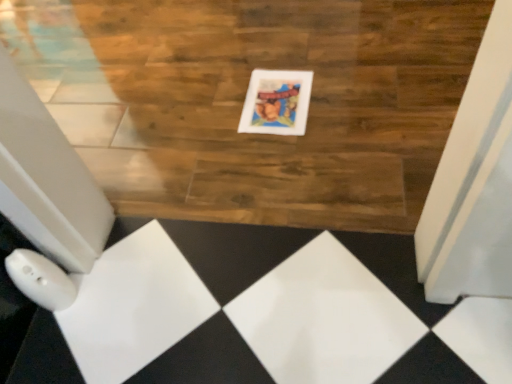
Identify the location of unoccupied space behind white glossy picture frame at center. This screenshot has width=512, height=384. (264, 56).